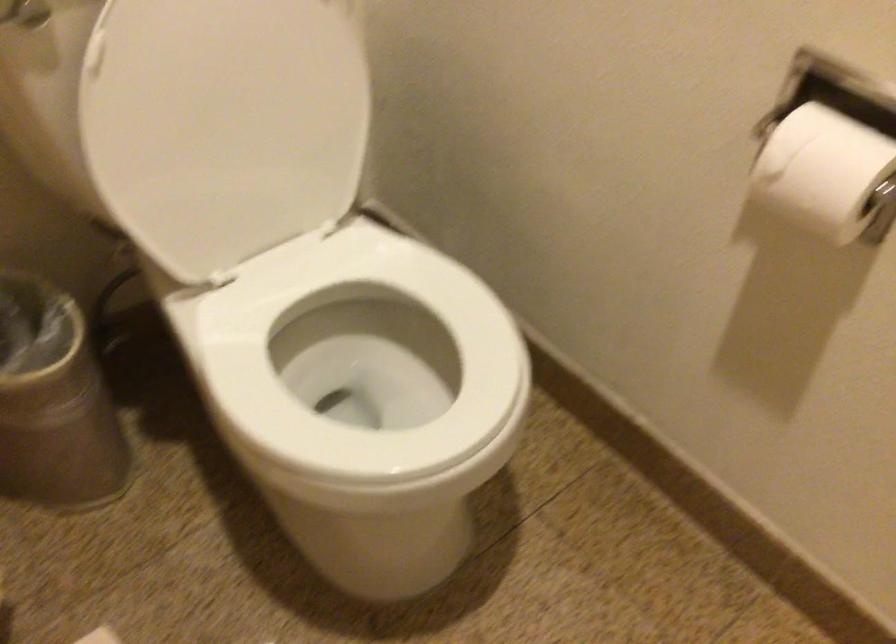
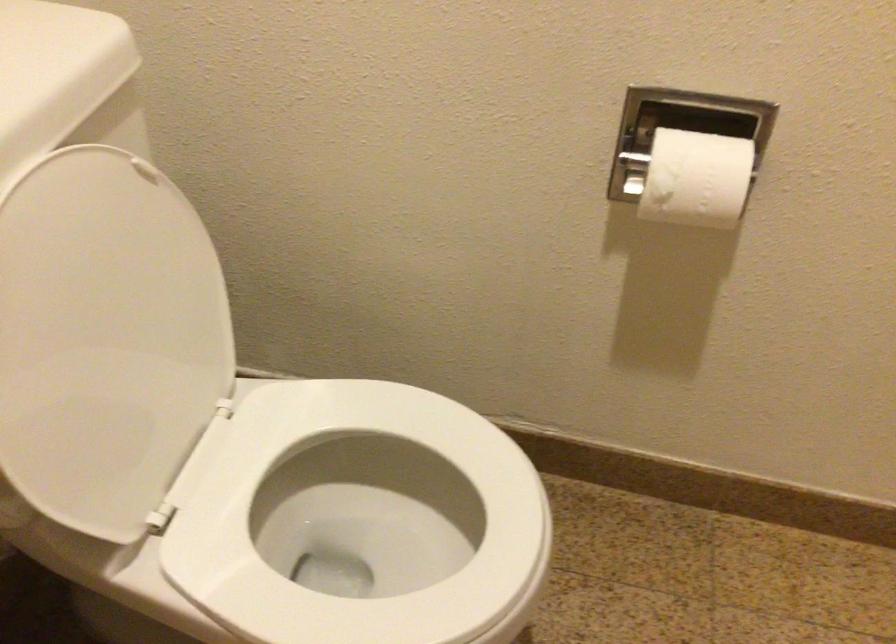
The point at (810, 172) is marked in the first image. Where is the corresponding point in the second image?

(695, 178)